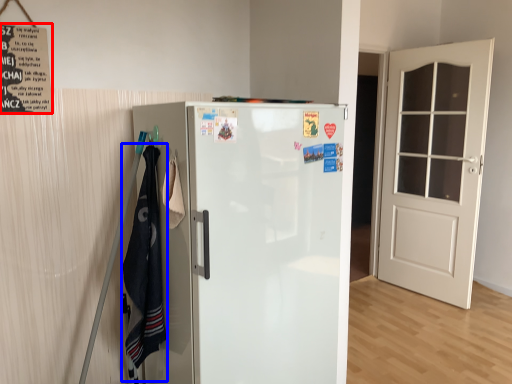
Question: Which object appears farthest to the camera in this image, poster (highlighted by a red box) or laundry (highlighted by a blue box)?

Choices:
 (A) poster
 (B) laundry

Answer: (A)